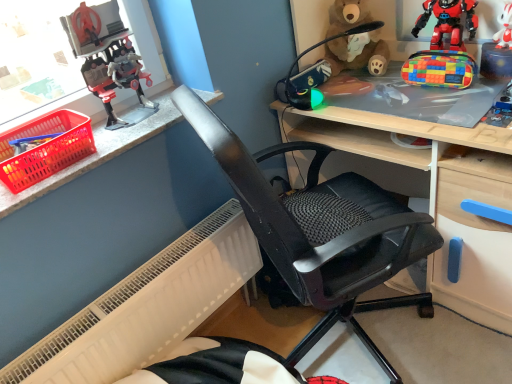
Question: From the image's perspective, is black mesh office chair at center on brown plush bear at upper center?

Choices:
 (A) no
 (B) yes

Answer: (A)

Question: Does black mesh office chair at center have a lesser width compared to brown plush bear at upper center?

Choices:
 (A) yes
 (B) no

Answer: (B)

Question: Can you confirm if black mesh office chair at center is bigger than brown plush bear at upper center?

Choices:
 (A) no
 (B) yes

Answer: (B)

Question: Considering the relative sizes of black mesh office chair at center and brown plush bear at upper center in the image provided, is black mesh office chair at center wider than brown plush bear at upper center?

Choices:
 (A) no
 (B) yes

Answer: (B)

Question: Is black mesh office chair at center positioned before brown plush bear at upper center?

Choices:
 (A) no
 (B) yes

Answer: (B)

Question: Which is correct: multicolored fabric pencil case at upper right, which appears as the 3th toy when viewed from the right, is inside plastic robot at upper left, which is the fifth toy in right-to-left order, or outside of it?

Choices:
 (A) outside
 (B) inside

Answer: (A)

Question: Is multicolored fabric pencil case at upper right, which appears as the 3th toy when viewed from the right, taller or shorter than plastic robot at upper left, which is the fifth toy in right-to-left order?

Choices:
 (A) tall
 (B) short

Answer: (B)

Question: Relative to plastic robot at upper left, the first toy from the left, is multicolored fabric pencil case at upper right, which appears as the 3th toy when viewed from the right, in front or behind?

Choices:
 (A) behind
 (B) front

Answer: (A)

Question: From a real-world perspective, is multicolored fabric pencil case at upper right, which appears as the 3th toy when viewed from the right, physically located above or below plastic robot at upper left, the first toy from the left?

Choices:
 (A) above
 (B) below

Answer: (B)

Question: From a real-world perspective, is white matte plush toy at upper right, which appears as the fifth toy when viewed from the left, physically located above or below white plastic radiator at lower left?

Choices:
 (A) below
 (B) above

Answer: (B)

Question: Is point (506, 1) positioned closer to the camera than point (193, 283)?

Choices:
 (A) farther
 (B) closer

Answer: (B)

Question: From their relative heights in the image, would you say white matte plush toy at upper right, which appears as the fifth toy when viewed from the left, is taller or shorter than white plastic radiator at lower left?

Choices:
 (A) short
 (B) tall

Answer: (A)

Question: From the image's perspective, is white matte plush toy at upper right, the 1th toy in the right-to-left sequence, positioned above or below white plastic radiator at lower left?

Choices:
 (A) below
 (B) above

Answer: (B)

Question: In the image, is white matte plush toy at upper right, which appears as the fifth toy when viewed from the left, positioned in front of or behind smooth stone counter top at upper left?

Choices:
 (A) behind
 (B) front

Answer: (A)

Question: Do you think white matte plush toy at upper right, which appears as the fifth toy when viewed from the left, is within smooth stone counter top at upper left, or outside of it?

Choices:
 (A) outside
 (B) inside

Answer: (A)